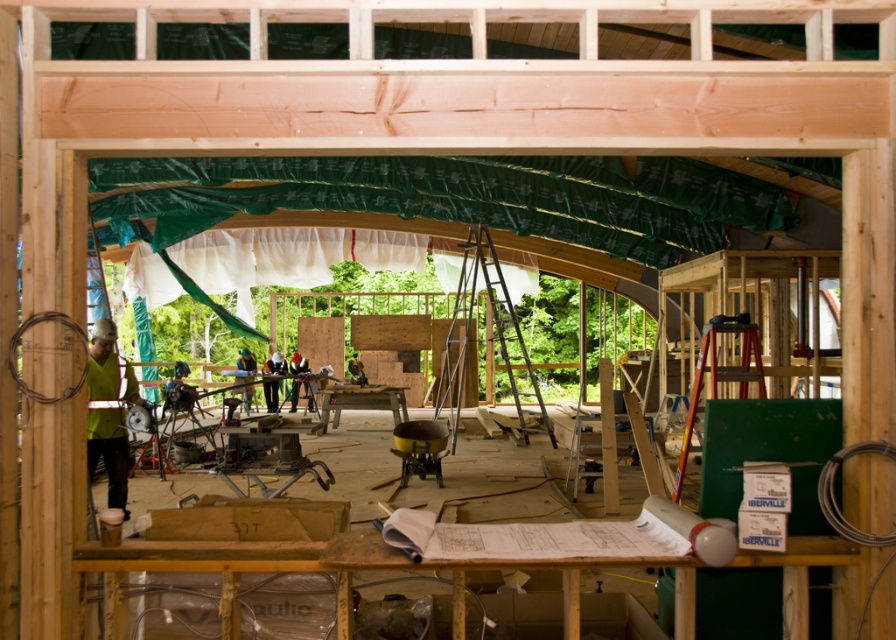
Question: Estimate the real-world distances between objects in this image. Which object is farther from the orange safety vest at center?

Choices:
 (A) yellow fabric at left
 (B) green fabric at center
 (C) golden brown hair at center
 (D) green safety vest at center

Answer: (A)

Question: Considering the real-world distances, which object is closest to the green fabric at center?

Choices:
 (A) green safety vest at center
 (B) yellow fabric at left
 (C) orange safety vest at center
 (D) golden brown hair at center

Answer: (A)

Question: Is green safety vest at center below orange safety vest at center?

Choices:
 (A) no
 (B) yes

Answer: (A)

Question: Which point is closer to the camera?

Choices:
 (A) (298, 371)
 (B) (89, 444)
 (C) (365, 380)
 (D) (279, 356)

Answer: (B)

Question: Is yellow fabric at left to the left of green fabric at center from the viewer's perspective?

Choices:
 (A) yes
 (B) no

Answer: (B)

Question: Is yellow fabric at left smaller than orange safety vest at center?

Choices:
 (A) no
 (B) yes

Answer: (A)